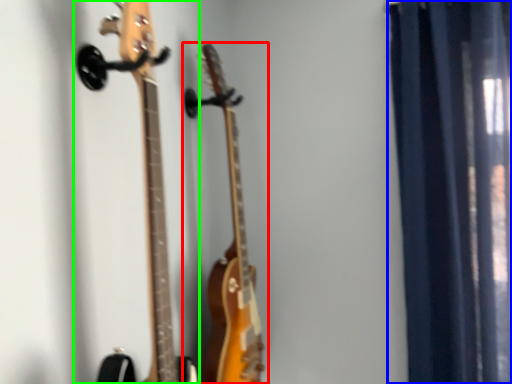
Question: Which is farther away from guitar (highlighted by a red box)? curtain (highlighted by a blue box) or guitar (highlighted by a green box)?

Choices:
 (A) curtain
 (B) guitar

Answer: (A)